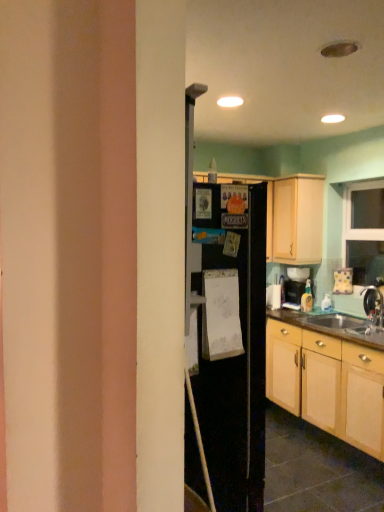
Question: Should I look upward or downward to see light wood cabinet at upper right, which is the 1th cabinetry in top-to-bottom order?

Choices:
 (A) up
 (B) down

Answer: (A)

Question: Is light wood cabinet at upper right, which is the 1th cabinetry in top-to-bottom order, oriented away from light wood cabinet at lower right, the 1th cabinetry in the bottom-to-top sequence?

Choices:
 (A) no
 (B) yes

Answer: (A)

Question: From a real-world perspective, is light wood cabinet at upper right, which is counted as the second cabinetry, starting from the bottom, over light wood cabinet at lower right, the 1th cabinetry in the bottom-to-top sequence?

Choices:
 (A) yes
 (B) no

Answer: (A)

Question: Is light wood cabinet at upper right, which is the 1th cabinetry in top-to-bottom order, positioned before light wood cabinet at lower right, the 1th cabinetry in the bottom-to-top sequence?

Choices:
 (A) yes
 (B) no

Answer: (B)

Question: Is there a large distance between light wood cabinet at upper right, which is the 1th cabinetry in top-to-bottom order, and light wood cabinet at lower right, the 1th cabinetry in the bottom-to-top sequence?

Choices:
 (A) yes
 (B) no

Answer: (A)

Question: Is light wood cabinet at upper right, which is the 1th cabinetry in top-to-bottom order, behind light wood cabinet at lower right, the 1th cabinetry in the bottom-to-top sequence?

Choices:
 (A) yes
 (B) no

Answer: (A)

Question: Is light wood cabinet at upper right, which is the 1th cabinetry in top-to-bottom order, to the right of light wood cabinet at lower right, the 1th cabinetry in the bottom-to-top sequence, from the viewer's perspective?

Choices:
 (A) no
 (B) yes

Answer: (A)

Question: From the image's perspective, is metallic silver faucet at lower right beneath light wood cabinet at lower right, the 1th cabinetry in the bottom-to-top sequence?

Choices:
 (A) yes
 (B) no

Answer: (B)

Question: From a real-world perspective, is metallic silver faucet at lower right below light wood cabinet at lower right, the second cabinetry when ordered from top to bottom?

Choices:
 (A) yes
 (B) no

Answer: (B)

Question: Is metallic silver faucet at lower right touching light wood cabinet at lower right, the 1th cabinetry in the bottom-to-top sequence?

Choices:
 (A) no
 (B) yes

Answer: (A)

Question: Could you tell me if metallic silver faucet at lower right is turned towards light wood cabinet at lower right, the 1th cabinetry in the bottom-to-top sequence?

Choices:
 (A) no
 (B) yes

Answer: (A)

Question: Is metallic silver faucet at lower right in front of light wood cabinet at lower right, the second cabinetry when ordered from top to bottom?

Choices:
 (A) no
 (B) yes

Answer: (A)

Question: Is metallic silver faucet at lower right at the right side of light wood cabinet at lower right, the second cabinetry when ordered from top to bottom?

Choices:
 (A) no
 (B) yes

Answer: (B)

Question: Is metallic silver faucet at lower right surrounded by brown wood countertop at lower right?

Choices:
 (A) no
 (B) yes

Answer: (A)